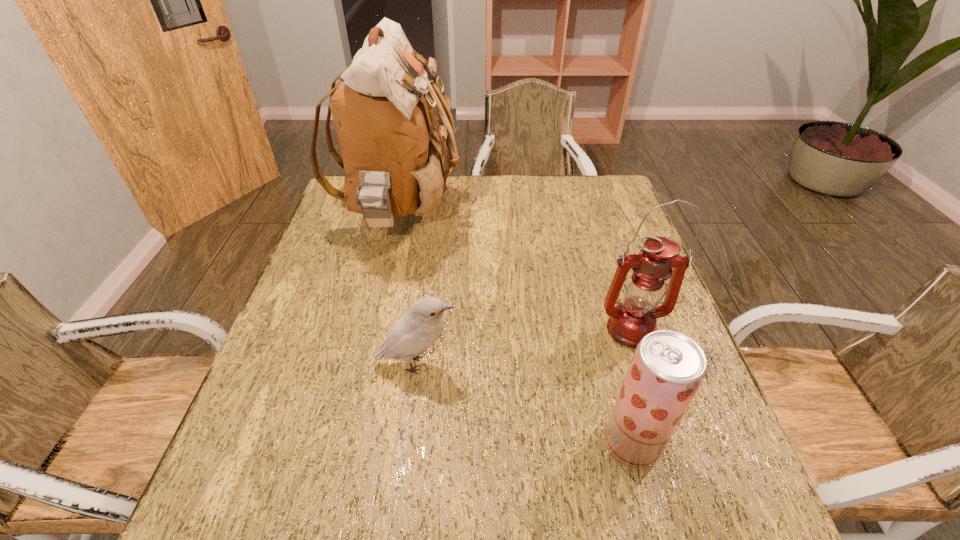
This screenshot has width=960, height=540. In the image, there is a desktop. Find the location of `vacant space at the far right corner`. vacant space at the far right corner is located at coordinates (593, 213).

Where is `vacant point located between the third nearest object and the backpack`? The height and width of the screenshot is (540, 960). vacant point located between the third nearest object and the backpack is located at coordinates (x=515, y=273).

Locate an element on the screen. unoccupied area between the farthest object and the oil lamp is located at coordinates (515, 273).

Where is `vacant space in between the second nearest object and the fruit juice`? The width and height of the screenshot is (960, 540). vacant space in between the second nearest object and the fruit juice is located at coordinates (524, 403).

Image resolution: width=960 pixels, height=540 pixels. Find the location of `free space between the bird and the third tallest object`. free space between the bird and the third tallest object is located at coordinates (524, 403).

Locate an element on the screen. Image resolution: width=960 pixels, height=540 pixels. blank region between the third nearest object and the bird is located at coordinates (523, 347).

Identify the location of unoccupied position between the shortest object and the third shortest object. The image size is (960, 540). (523, 347).

The width and height of the screenshot is (960, 540). In order to click on unoccupied area between the farthest object and the third farthest object in this screenshot , I will do `click(408, 290)`.

This screenshot has width=960, height=540. Find the location of `vacant space in between the bird and the tallest object`. vacant space in between the bird and the tallest object is located at coordinates (408, 290).

Locate an element on the screen. This screenshot has height=540, width=960. object that is the closest to the shortest object is located at coordinates (394, 148).